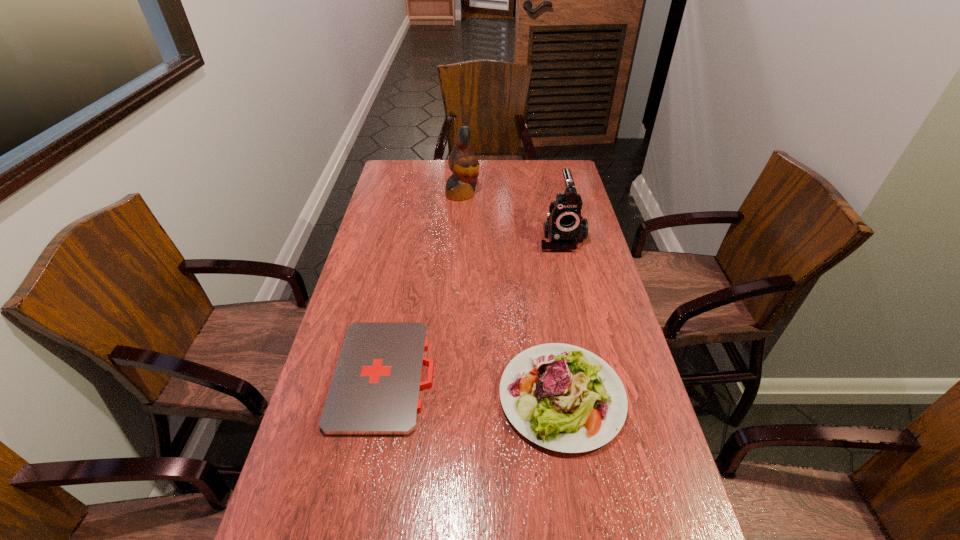
Find the location of a particular element. the tallest object is located at coordinates (463, 163).

Find the location of a particular element. The height and width of the screenshot is (540, 960). parrot is located at coordinates (463, 163).

Where is `the second farthest object`? The image size is (960, 540). the second farthest object is located at coordinates (565, 227).

Identify the location of camcorder. The image size is (960, 540). (565, 227).

Locate an element on the screen. This screenshot has width=960, height=540. salad plate is located at coordinates (562, 397).

Find the location of `the shortest object`. the shortest object is located at coordinates (375, 390).

The image size is (960, 540). I want to click on vacant space located on the face of the parrot, so click(526, 194).

Locate an element on the screen. vacant space located 0.180m on the lens mount of the second farthest object is located at coordinates (572, 288).

Where is `free point located on the back of the salad plate`? This screenshot has height=540, width=960. free point located on the back of the salad plate is located at coordinates (541, 269).

Where is `vacant area situated on handle side the first-aid kit`? Image resolution: width=960 pixels, height=540 pixels. vacant area situated on handle side the first-aid kit is located at coordinates (492, 375).